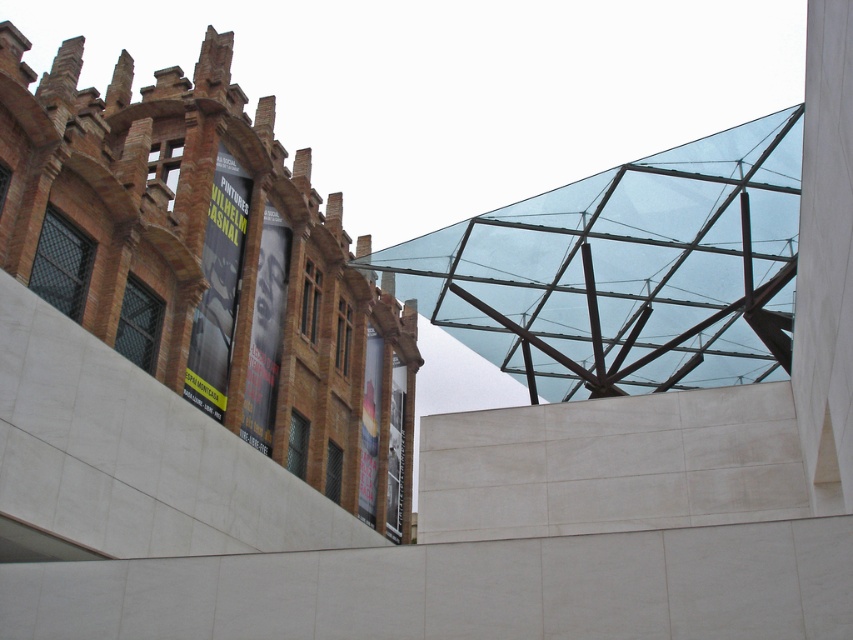
You are standing in front of the building with the reddish brown brick section and the modern structure. Where is the transparent glass pyramid at upper center located in relation to the point marked as point (210, 266)?

The transparent glass pyramid at upper center is located at point (210, 266).

You are an architect visiting the building and want to install a new sculpture. The sculpture requires a base that can only be placed on a transparent glass structure larger than 5 meters. Which structure should you choose between the transparent glass pyramid at upper center and the transparent glass roof at upper center?

The transparent glass pyramid at upper center is bigger than the transparent glass roof at upper center, so the sculpture should be placed on the transparent glass pyramid at upper center as it meets the size requirement.

You are standing at the point with coordinates closest to the center of the image. You want to walk towards the point labeled as point (245, 428). However, there is an obstacle at point (585, 330). Will you encounter this obstacle before reaching your destination?

Since point (245, 428) is behind point (585, 330), you will encounter the obstacle at point (585, 330) before reaching your destination.